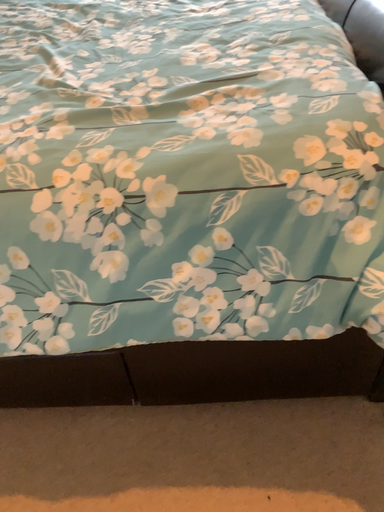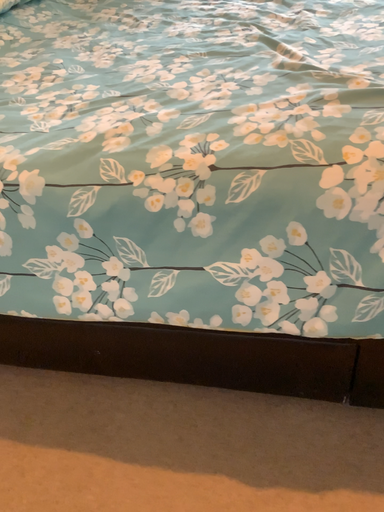
Question: Which way did the camera rotate in the video?

Choices:
 (A) rotated left
 (B) rotated right

Answer: (A)